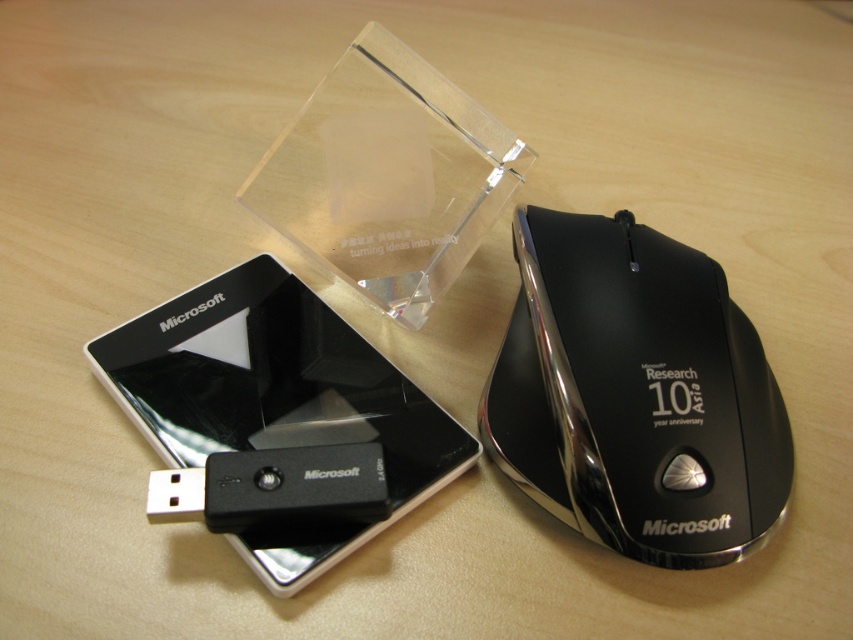
Question: Among these points, which one is nearest to the camera?

Choices:
 (A) (718, 449)
 (B) (294, 550)

Answer: (B)

Question: Which point is farther to the camera?

Choices:
 (A) [x=209, y=307]
 (B) [x=602, y=524]

Answer: (A)

Question: Does black glossy mouse at right come behind black glossy smartphone at upper left?

Choices:
 (A) yes
 (B) no

Answer: (B)

Question: Does black glossy mouse at right appear on the right side of black glossy smartphone at upper left?

Choices:
 (A) no
 (B) yes

Answer: (B)

Question: Which object is farther from the camera taking this photo?

Choices:
 (A) black glossy mouse at right
 (B) black glossy smartphone at upper left

Answer: (B)

Question: Is black glossy mouse at right above black glossy smartphone at upper left?

Choices:
 (A) no
 (B) yes

Answer: (B)